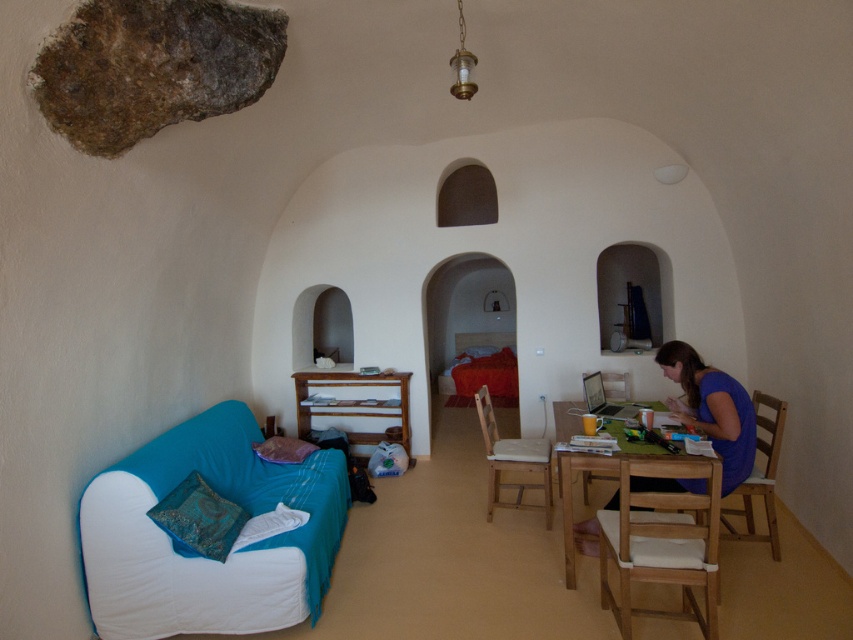
You are sitting on the sofa and want to place a book on the wooden table at center. Can you directly reach the table without moving around the blue fabric shirt at lower right?

The wooden table at center is behind the blue fabric shirt at lower right, so you cannot directly reach it without moving around the blue fabric shirt at lower right.

You are planning to place a small table between the light brown wooden chair at center and the purple fabric pillow at lower left. Considering their sizes, will the table fit comfortably between them?

The light brown wooden chair at center is wider than the purple fabric pillow at lower left, so there should be enough space to place a small table between them comfortably.